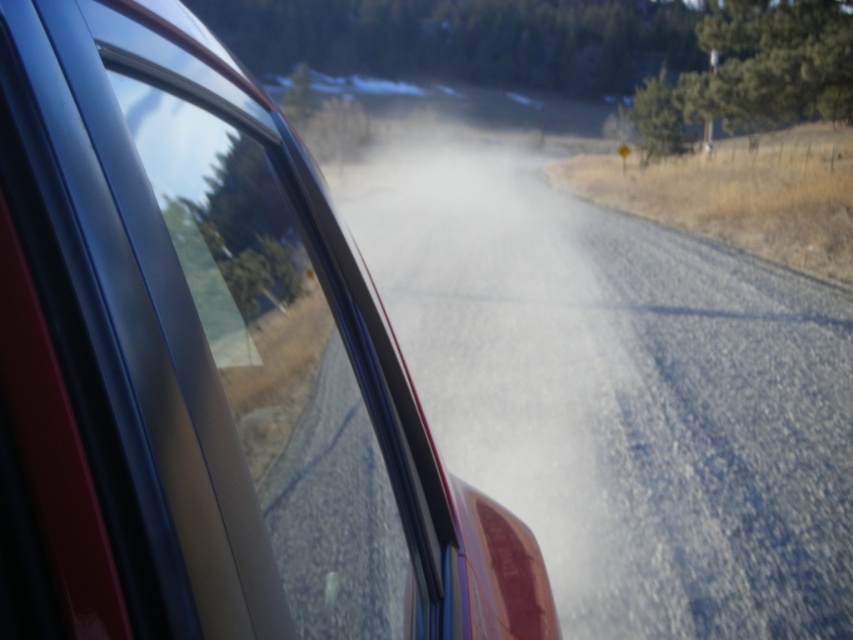
Between point (236, 611) and point (444, 369), which one is positioned in front?

Point (236, 611) is more forward.

Does glossy metallic car at center lie behind white powdery dust at center?

No, glossy metallic car at center is in front of white powdery dust at center.

Which is behind, point (160, 113) or point (509, 321)?

The point (509, 321) is behind.

Where is `glossy metallic car at center`? glossy metallic car at center is located at coordinates (207, 369).